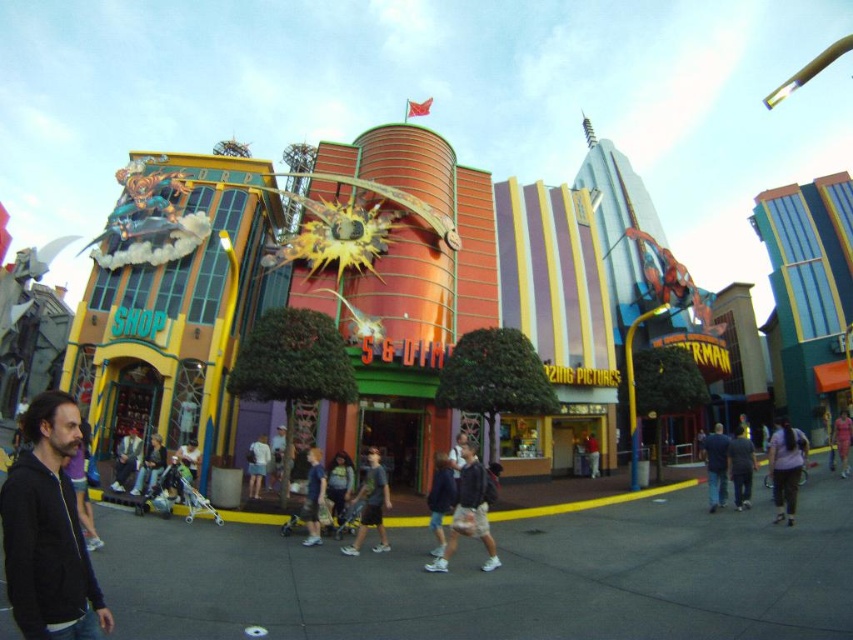
You are a photographer positioned at the entrance of the theme park, aiming to capture a full body shot of a visitor wearing a dark gray hoodie at center and light blue denim shorts at center. Given the camera lens you have, you can only capture objects up to 1.2 meters in width. Which clothing item might exceed the camera lens width limit?

The dark gray hoodie at center has a greater width than the light blue denim shorts at center, so the dark gray hoodie at center might exceed the camera lens width limit of 1.2 meters.

You are standing in the theme park and see both the denim jacket at center and the pink fabric dress at center. Which one is farther from you?

The denim jacket at center is 216.91 feet away from the pink fabric dress at center, so whichever is closer to you, the other would be farther. However, since both are at the center, their distance from you depends on your exact position. Without knowing your exact location, it is impossible to determine which is farther.